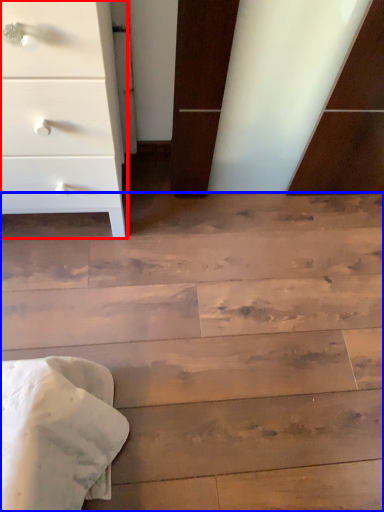
Question: Which object appears farthest to the camera in this image, chest of drawers (highlighted by a red box) or stairwell (highlighted by a blue box)?

Choices:
 (A) chest of drawers
 (B) stairwell

Answer: (B)